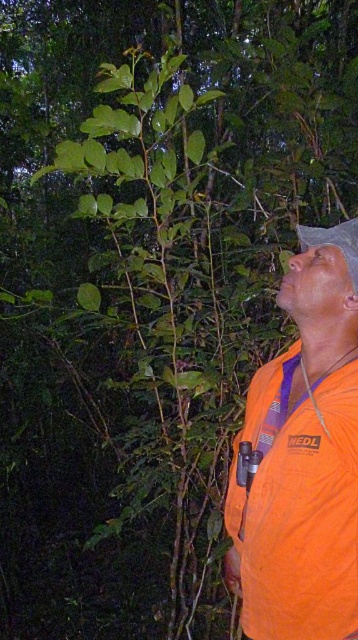
Question: Is orange fabric shirt at right thinner than white matte hat at upper right?

Choices:
 (A) yes
 (B) no

Answer: (B)

Question: Does orange fabric shirt at right appear on the right side of white matte hat at upper right?

Choices:
 (A) no
 (B) yes

Answer: (A)

Question: Which point is closer to the camera?

Choices:
 (A) white matte hat at upper right
 (B) orange fabric shirt at right

Answer: (B)

Question: Which object appears closest to the camera in this image?

Choices:
 (A) white matte hat at upper right
 (B) orange fabric shirt at right

Answer: (B)

Question: Considering the relative positions of orange fabric shirt at right and white matte hat at upper right in the image provided, where is orange fabric shirt at right located with respect to white matte hat at upper right?

Choices:
 (A) right
 (B) left

Answer: (B)